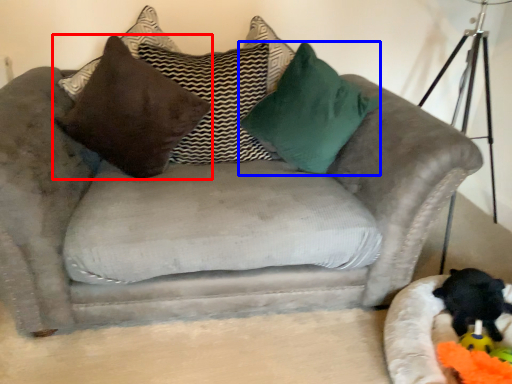
Question: Which of the following is the closest to the observer, pillow (highlighted by a red box) or pillow (highlighted by a blue box)?

Choices:
 (A) pillow
 (B) pillow

Answer: (B)